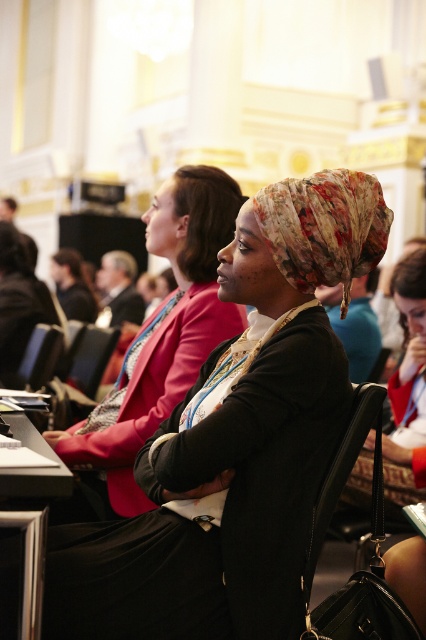
Describe the element at coordinates (164, 332) in the screenshot. I see `floral fabric headscarf at center` at that location.

Which is behind, point (184, 291) or point (108, 339)?

The point (108, 339) is behind.

Which is behind, point (106, 468) or point (89, 369)?

The point (89, 369) is more distant.

Where is `floral fabric headscarf at center`? floral fabric headscarf at center is located at coordinates click(164, 332).

Is floral-patterned headscarf at center to the left of floral fabric headscarf at center from the viewer's perspective?

Incorrect, floral-patterned headscarf at center is not on the left side of floral fabric headscarf at center.

Between floral-patterned headscarf at center and floral fabric headscarf at center, which one is positioned lower?

Positioned lower is floral-patterned headscarf at center.

Measure the distance between floral-patterned headscarf at center and camera.

floral-patterned headscarf at center and camera are 30.39 feet apart.

Where is `floral-patterned headscarf at center`? This screenshot has width=426, height=640. floral-patterned headscarf at center is located at coordinates (235, 442).

The image size is (426, 640). What do you see at coordinates (235, 442) in the screenshot?
I see `floral-patterned headscarf at center` at bounding box center [235, 442].

Can you confirm if floral-patterned headscarf at center is positioned above black leather chair at center?

Yes.

Is point (187, 492) positioned in front of point (97, 376)?

Yes, point (187, 492) is in front of point (97, 376).

Where is `floral-patterned headscarf at center`? This screenshot has height=640, width=426. floral-patterned headscarf at center is located at coordinates (235, 442).